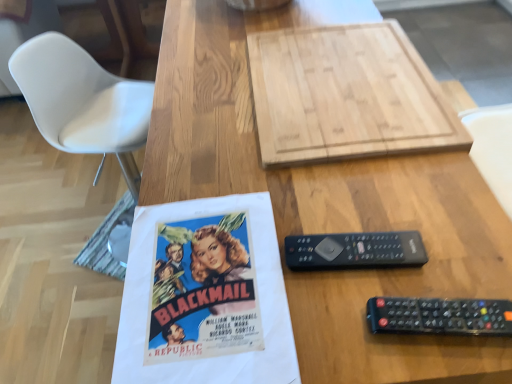
Question: Is natural wood cutting board at upper center completely or partially inside black plastic remote at right?

Choices:
 (A) yes
 (B) no

Answer: (B)

Question: Is black plastic remote at right not within natural wood cutting board at upper center?

Choices:
 (A) no
 (B) yes

Answer: (B)

Question: Is black plastic remote at right bigger than natural wood cutting board at upper center?

Choices:
 (A) no
 (B) yes

Answer: (A)

Question: Is black plastic remote at right wider than natural wood cutting board at upper center?

Choices:
 (A) no
 (B) yes

Answer: (A)

Question: Is black plastic remote at right positioned before natural wood cutting board at upper center?

Choices:
 (A) yes
 (B) no

Answer: (A)

Question: From a real-world perspective, is black plastic remote at right above or below black plastic remote at lower right?

Choices:
 (A) below
 (B) above

Answer: (A)

Question: Considering the positions of black plastic remote at right and black plastic remote at lower right in the image, is black plastic remote at right wider or thinner than black plastic remote at lower right?

Choices:
 (A) wide
 (B) thin

Answer: (A)

Question: Is black plastic remote at right in front of or behind black plastic remote at lower right in the image?

Choices:
 (A) front
 (B) behind

Answer: (B)

Question: Is black plastic remote at right spatially inside black plastic remote at lower right, or outside of it?

Choices:
 (A) outside
 (B) inside

Answer: (A)

Question: Considering the positions of black plastic remote at lower right and natural wood cutting board at upper center in the image, is black plastic remote at lower right taller or shorter than natural wood cutting board at upper center?

Choices:
 (A) short
 (B) tall

Answer: (A)

Question: From a real-world perspective, relative to natural wood cutting board at upper center, is black plastic remote at lower right vertically above or below?

Choices:
 (A) below
 (B) above

Answer: (B)

Question: Is black plastic remote at lower right situated inside natural wood cutting board at upper center or outside?

Choices:
 (A) inside
 (B) outside

Answer: (B)

Question: In the image, is black plastic remote at lower right positioned in front of or behind natural wood cutting board at upper center?

Choices:
 (A) front
 (B) behind

Answer: (A)

Question: From the image's perspective, is black plastic remote at right positioned above or below natural wood cutting board at upper center?

Choices:
 (A) above
 (B) below

Answer: (B)

Question: Visually, is black plastic remote at right positioned to the left or to the right of natural wood cutting board at upper center?

Choices:
 (A) left
 (B) right

Answer: (A)